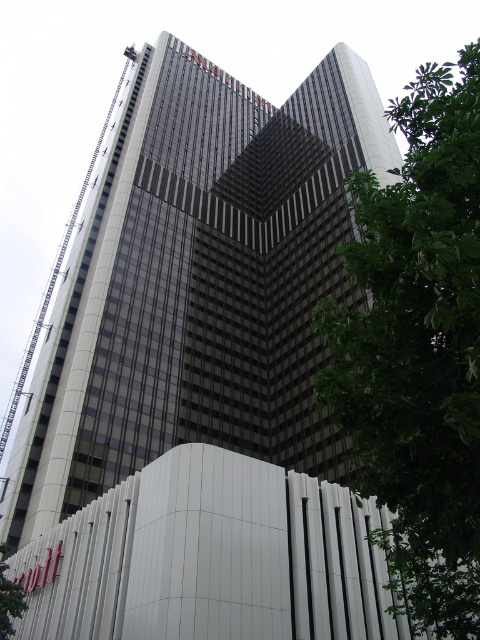
Question: Is glassy reflective skyscraper at center above green leafy tree at right?

Choices:
 (A) yes
 (B) no

Answer: (B)

Question: Which point is closer to the camera taking this photo?

Choices:
 (A) (317, 205)
 (B) (409, 380)

Answer: (B)

Question: Observing the image, what is the correct spatial positioning of glassy reflective skyscraper at center in reference to green leafy tree at right?

Choices:
 (A) below
 (B) above

Answer: (A)

Question: Can you confirm if glassy reflective skyscraper at center is positioned to the right of green leafy tree at right?

Choices:
 (A) no
 (B) yes

Answer: (A)